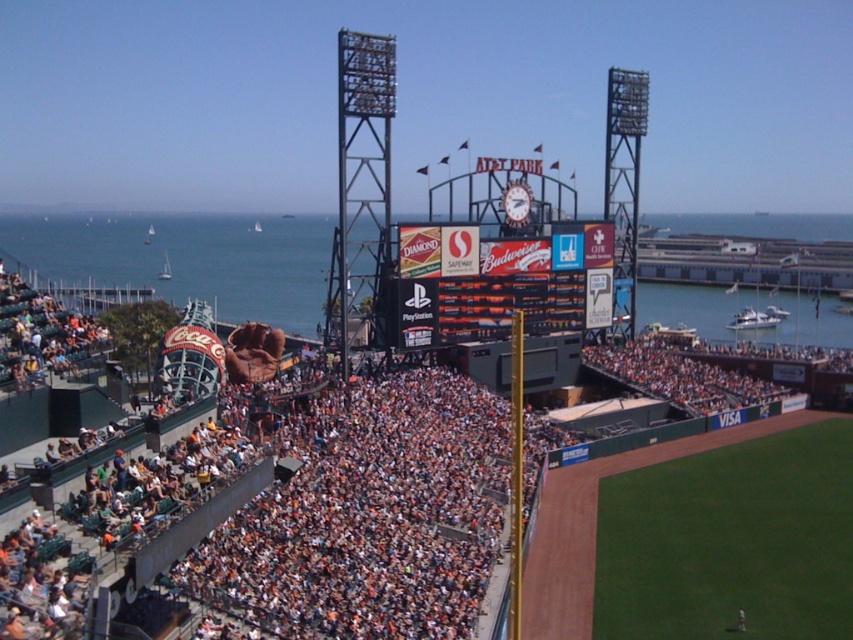
You are a photographer at AT T Park and want to capture both the point at (9, 228) and the point at (502, 241) in a single shot. Which point is closer to the camera and should be in focus first?

The point at (9, 228) is closer to the camera and should be in focus first because it is further to the viewer than the other point.

You are a photographer at AT T Park and want to capture a photo of the orange fabric crowd at center and the blue water at center in the same frame. Based on their positions, which object should appear higher in the photo?

The orange fabric crowd at center is located below blue water at center, so the blue water at center will appear higher in the photo.